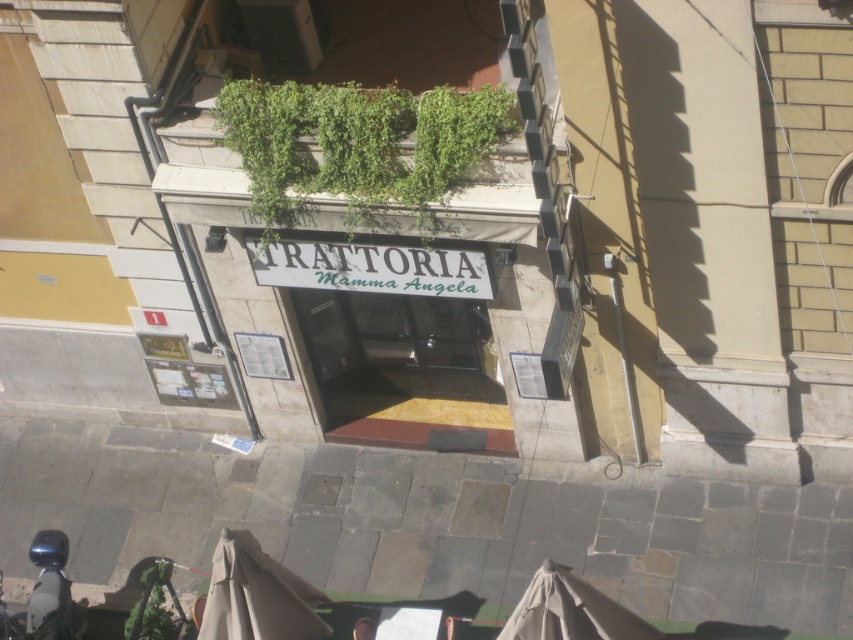
You are standing at the entrance of Trattoria Mamma Angela and want to enter. The black glass door at center and the green leafy plant at lower left are in your view. Which object is positioned to the right side?

The black glass door at center is to the right of the green leafy plant at lower left according to the description.

You are standing outside the restaurant entrance and need to enter. The black glass door at center is the entrance. There is a green leafy plant at center nearby. Which object is closer to you when you are facing the entrance?

The green leafy plant at center is smaller than the black glass door at center, but their distance from you isn not specified in the description. Therefore, I cannot determine which is closer based on the provided information.

In the scene shown: You are a delivery person arriving at Trattoria Mamma Angela. You see a shiny blue motorcycle at lower left and a green leafy plant at lower left. Which object takes up more space in the scene?

The shiny blue motorcycle at lower left is larger in size than the green leafy plant at lower left, so the motorcycle takes up more space in the scene.